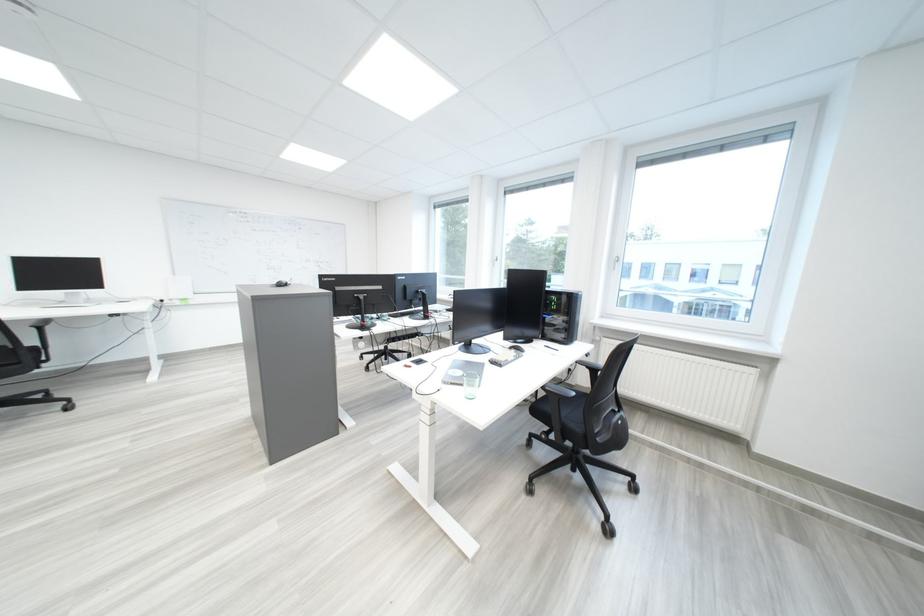
Find the location of a particular element. The height and width of the screenshot is (616, 924). clear drinking glass is located at coordinates coord(469,384).